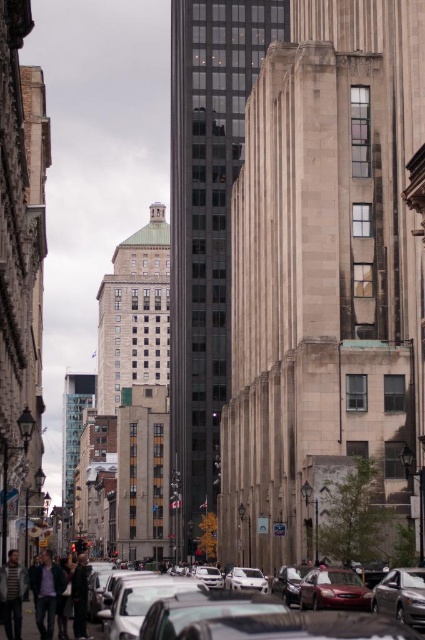
Question: Does dark gray jacket at lower left have a larger size compared to dark brown leather jacket at lower left?

Choices:
 (A) yes
 (B) no

Answer: (A)

Question: Which of the following is the closest to the observer?

Choices:
 (A) dark gray jacket at lower left
 (B) dark brown leather jacket at lower left

Answer: (A)

Question: Is shiny silver sedan at lower right closer to camera compared to silver metallic car at center?

Choices:
 (A) no
 (B) yes

Answer: (B)

Question: Estimate the real-world distances between objects in this image. Which object is farther from the shiny silver sedan at center?

Choices:
 (A) dark brown leather jacket at lower left
 (B) dark gray jacket at lower left

Answer: (B)

Question: Does dark gray jacket at lower left have a greater width compared to silver metallic car at center?

Choices:
 (A) yes
 (B) no

Answer: (A)

Question: Which of the following is the closest to the observer?

Choices:
 (A) dark brown leather jacket at lower left
 (B) dark brown leather jacket at lower center
 (C) shiny silver sedan at center
 (D) shiny silver sedan at lower right

Answer: (C)